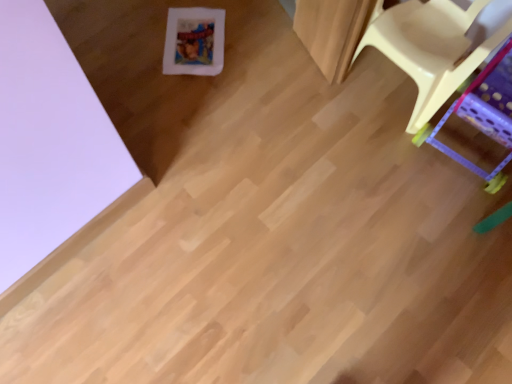
This screenshot has height=384, width=512. What do you see at coordinates (484, 114) in the screenshot? I see `yellow plastic chair at right, which appears as the 1th furniture when viewed from the right` at bounding box center [484, 114].

The width and height of the screenshot is (512, 384). Find the location of `yellow plastic chair at right, marked as the second furniture in a left-to-right arrangement`. yellow plastic chair at right, marked as the second furniture in a left-to-right arrangement is located at coordinates (484, 114).

Describe the element at coordinates (430, 48) in the screenshot. I see `matte plastic chair at right, which is the first furniture from left to right` at that location.

I want to click on matte plastic chair at right, which is the first furniture from left to right, so click(x=430, y=48).

Find the location of `yellow plastic chair at right, marked as the second furniture in a left-to-right arrangement`. yellow plastic chair at right, marked as the second furniture in a left-to-right arrangement is located at coordinates (484, 114).

Considering the relative positions of matte plastic chair at right, which is the first furniture from left to right, and yellow plastic chair at right, marked as the second furniture in a left-to-right arrangement, in the image provided, is matte plastic chair at right, which is the first furniture from left to right, to the left of yellow plastic chair at right, marked as the second furniture in a left-to-right arrangement, from the viewer's perspective?

Correct, you'll find matte plastic chair at right, which is the first furniture from left to right, to the left of yellow plastic chair at right, marked as the second furniture in a left-to-right arrangement.

Between matte plastic chair at right, the 2th furniture viewed from the right, and yellow plastic chair at right, marked as the second furniture in a left-to-right arrangement, which one is positioned in front?

yellow plastic chair at right, marked as the second furniture in a left-to-right arrangement, is in front.

Is point (442, 84) behind point (439, 124)?

No, (442, 84) is in front of (439, 124).

From the image's perspective, is matte plastic chair at right, the 2th furniture viewed from the right, located above yellow plastic chair at right, which appears as the 1th furniture when viewed from the right?

Yes, from the image's perspective, matte plastic chair at right, the 2th furniture viewed from the right, is over yellow plastic chair at right, which appears as the 1th furniture when viewed from the right.

From a real-world perspective, between matte plastic chair at right, which is the first furniture from left to right, and yellow plastic chair at right, which appears as the 1th furniture when viewed from the right, who is vertically lower?

yellow plastic chair at right, which appears as the 1th furniture when viewed from the right, from a real-world perspective.

Between matte plastic chair at right, which is the first furniture from left to right, and yellow plastic chair at right, marked as the second furniture in a left-to-right arrangement, which one has smaller width?

With smaller width is matte plastic chair at right, which is the first furniture from left to right.

Considering the sizes of objects matte plastic chair at right, which is the first furniture from left to right, and yellow plastic chair at right, marked as the second furniture in a left-to-right arrangement, in the image provided, who is taller, matte plastic chair at right, which is the first furniture from left to right, or yellow plastic chair at right, marked as the second furniture in a left-to-right arrangement,?

Standing taller between the two is matte plastic chair at right, which is the first furniture from left to right.

From the picture: Considering the relative sizes of matte plastic chair at right, the 2th furniture viewed from the right, and yellow plastic chair at right, marked as the second furniture in a left-to-right arrangement, in the image provided, is matte plastic chair at right, the 2th furniture viewed from the right, smaller than yellow plastic chair at right, marked as the second furniture in a left-to-right arrangement,?

Actually, matte plastic chair at right, the 2th furniture viewed from the right, might be larger than yellow plastic chair at right, marked as the second furniture in a left-to-right arrangement.

Would you say matte plastic chair at right, the 2th furniture viewed from the right, is inside or outside yellow plastic chair at right, which appears as the 1th furniture when viewed from the right?

The correct answer is: outside.

Is matte plastic chair at right, the 2th furniture viewed from the right, far away from yellow plastic chair at right, which appears as the 1th furniture when viewed from the right?

No, matte plastic chair at right, the 2th furniture viewed from the right, is not far away from yellow plastic chair at right, which appears as the 1th furniture when viewed from the right.

Looking at this image, is matte plastic chair at right, which is the first furniture from left to right, facing away from yellow plastic chair at right, which appears as the 1th furniture when viewed from the right?

No, matte plastic chair at right, which is the first furniture from left to right, is not facing the opposite direction of yellow plastic chair at right, which appears as the 1th furniture when viewed from the right.

How different are the orientations of matte plastic chair at right, the 2th furniture viewed from the right, and yellow plastic chair at right, which appears as the 1th furniture when viewed from the right, in degrees?

1.2 degrees.

Locate an element on the screen. The image size is (512, 384). furniture behind the yellow plastic chair at right, marked as the second furniture in a left-to-right arrangement is located at coordinates (430, 48).

Which object is positioned more to the left, yellow plastic chair at right, marked as the second furniture in a left-to-right arrangement, or matte plastic chair at right, which is the first furniture from left to right?

matte plastic chair at right, which is the first furniture from left to right.

Which object is further away from the camera taking this photo, yellow plastic chair at right, which appears as the 1th furniture when viewed from the right, or matte plastic chair at right, which is the first furniture from left to right?

matte plastic chair at right, which is the first furniture from left to right, is further from the camera.

Which point is more forward, (x=504, y=212) or (x=391, y=45)?

The point (x=504, y=212) is more forward.

From the image's perspective, which one is positioned lower, yellow plastic chair at right, marked as the second furniture in a left-to-right arrangement, or matte plastic chair at right, which is the first furniture from left to right?

yellow plastic chair at right, marked as the second furniture in a left-to-right arrangement, is shown below in the image.

From a real-world perspective, which object rests below the other?

yellow plastic chair at right, marked as the second furniture in a left-to-right arrangement, from a real-world perspective.

Does yellow plastic chair at right, marked as the second furniture in a left-to-right arrangement, have a lesser width compared to matte plastic chair at right, which is the first furniture from left to right?

In fact, yellow plastic chair at right, marked as the second furniture in a left-to-right arrangement, might be wider than matte plastic chair at right, which is the first furniture from left to right.

Considering the sizes of objects yellow plastic chair at right, which appears as the 1th furniture when viewed from the right, and matte plastic chair at right, the 2th furniture viewed from the right, in the image provided, who is taller, yellow plastic chair at right, which appears as the 1th furniture when viewed from the right, or matte plastic chair at right, the 2th furniture viewed from the right,?

Standing taller between the two is matte plastic chair at right, the 2th furniture viewed from the right.

Based on their sizes in the image, would you say yellow plastic chair at right, marked as the second furniture in a left-to-right arrangement, is bigger or smaller than matte plastic chair at right, the 2th furniture viewed from the right?

Clearly, yellow plastic chair at right, marked as the second furniture in a left-to-right arrangement, is smaller in size than matte plastic chair at right, the 2th furniture viewed from the right.

Would you say yellow plastic chair at right, marked as the second furniture in a left-to-right arrangement, is outside matte plastic chair at right, which is the first furniture from left to right?

Yes, yellow plastic chair at right, marked as the second furniture in a left-to-right arrangement, is located beyond the bounds of matte plastic chair at right, which is the first furniture from left to right.

Consider the image. Is yellow plastic chair at right, which appears as the 1th furniture when viewed from the right, in contact with matte plastic chair at right, the 2th furniture viewed from the right?

No, yellow plastic chair at right, which appears as the 1th furniture when viewed from the right, is not next to matte plastic chair at right, the 2th furniture viewed from the right.

Is yellow plastic chair at right, which appears as the 1th furniture when viewed from the right, facing towards matte plastic chair at right, which is the first furniture from left to right?

No, yellow plastic chair at right, which appears as the 1th furniture when viewed from the right, is not turned towards matte plastic chair at right, which is the first furniture from left to right.

Find the location of `furniture that appears below the matte plastic chair at right, which is the first furniture from left to right (from a real-world perspective)`. furniture that appears below the matte plastic chair at right, which is the first furniture from left to right (from a real-world perspective) is located at coordinates (484, 114).

Where is `furniture on the left of yellow plastic chair at right, marked as the second furniture in a left-to-right arrangement`? furniture on the left of yellow plastic chair at right, marked as the second furniture in a left-to-right arrangement is located at coordinates (430, 48).

The height and width of the screenshot is (384, 512). I want to click on furniture that appears below the matte plastic chair at right, which is the first furniture from left to right (from a real-world perspective), so click(484, 114).